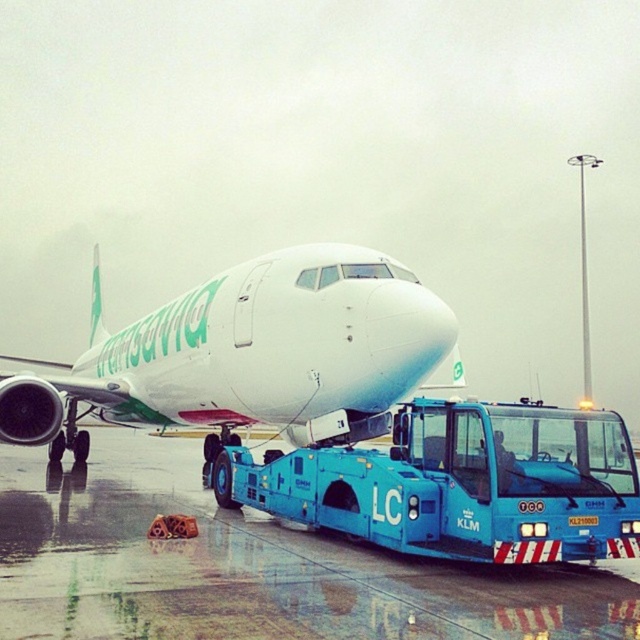
Question: Which point is farther to the camera?

Choices:
 (A) white glossy airplane at upper center
 (B) wet asphalt runway at lower center

Answer: (A)

Question: Does white glossy airplane at upper center appear on the right side of blue metallic tow truck at center?

Choices:
 (A) yes
 (B) no

Answer: (B)

Question: Estimate the real-world distances between objects in this image. Which object is closer to the white glossy airplane at upper center?

Choices:
 (A) wet asphalt runway at lower center
 (B) blue metallic tow truck at center

Answer: (A)

Question: Which of the following is the closest to the observer?

Choices:
 (A) blue metallic tow truck at center
 (B) wet asphalt runway at lower center
 (C) white glossy airplane at upper center

Answer: (B)

Question: Is wet asphalt runway at lower center bigger than white glossy airplane at upper center?

Choices:
 (A) no
 (B) yes

Answer: (A)

Question: Can you confirm if wet asphalt runway at lower center is positioned to the right of white glossy airplane at upper center?

Choices:
 (A) no
 (B) yes

Answer: (B)